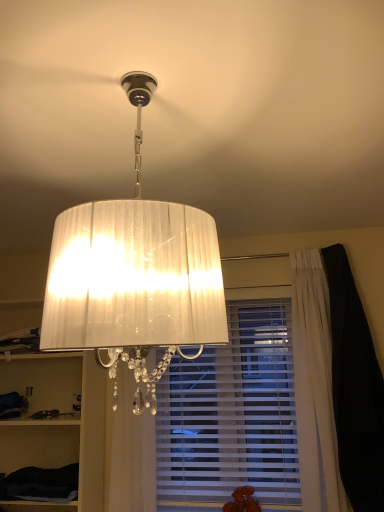
Measure the distance between point (x=176, y=398) and camera.

→ The distance of point (x=176, y=398) from camera is 7.75 feet.

In order to face white pleated curtain at lower center, should I rotate leftwards or rightwards?

To face it directly, rotate right by 4.107 degrees.

Identify the location of dark fabric cabinet at lower left, which is the first cabinet in bottom-to-top order. The image size is (384, 512). (37, 445).

In order to click on black velvet curtain at right in this screenshot , I will do `click(355, 388)`.

Between white fabric cabinet at left, the first cabinet when ordered from top to bottom, and white sheer curtain at center, which one has smaller size?

Smaller between the two is white sheer curtain at center.

Does point (47, 467) appear closer or farther from the camera than point (107, 435)?

Point (47, 467) appears to be farther away from the viewer than point (107, 435).

Looking at this image, from a real-world perspective, is white fabric cabinet at left, the first cabinet when ordered from top to bottom, above or below white sheer curtain at center?

white fabric cabinet at left, the first cabinet when ordered from top to bottom, is above white sheer curtain at center.

Consider the image. Considering the sizes of objects white pleated curtain at lower center and white sheer curtain at center in the image provided, who is shorter, white pleated curtain at lower center or white sheer curtain at center?

With less height is white sheer curtain at center.

Is white pleated curtain at lower center closer to the viewer compared to white sheer curtain at center?

No, the depth of white pleated curtain at lower center is greater than that of white sheer curtain at center.

Can you tell me how much white pleated curtain at lower center and white sheer curtain at center differ in facing direction?

The angular difference between white pleated curtain at lower center and white sheer curtain at center is 0.106 degrees.

Measure the distance between white pleated curtain at lower center and white sheer curtain at center.

A distance of 18.44 inches exists between white pleated curtain at lower center and white sheer curtain at center.

Considering the relative sizes of white fabric cabinet at left, which ranks as the 2th cabinet in bottom-to-top order, and white pleated fabric lampshade at upper center in the image provided, is white fabric cabinet at left, which ranks as the 2th cabinet in bottom-to-top order, shorter than white pleated fabric lampshade at upper center?

No.

Is white fabric cabinet at left, which ranks as the 2th cabinet in bottom-to-top order, wider than white pleated fabric lampshade at upper center?

In fact, white fabric cabinet at left, which ranks as the 2th cabinet in bottom-to-top order, might be narrower than white pleated fabric lampshade at upper center.

From the image's perspective, is white fabric cabinet at left, which ranks as the 2th cabinet in bottom-to-top order, on white pleated fabric lampshade at upper center?

Actually, white fabric cabinet at left, which ranks as the 2th cabinet in bottom-to-top order, appears below white pleated fabric lampshade at upper center in the image.

Considering the relative positions of white fabric cabinet at left, the first cabinet when ordered from top to bottom, and white pleated fabric lampshade at upper center in the image provided, is white fabric cabinet at left, the first cabinet when ordered from top to bottom, to the left of white pleated fabric lampshade at upper center from the viewer's perspective?

Yes.

From a real-world perspective, who is located higher, dark fabric cabinet at lower left, which is the first cabinet in bottom-to-top order, or black velvet curtain at right?

In real-world perspective, black velvet curtain at right is above.

Who is shorter, dark fabric cabinet at lower left, which is the first cabinet in bottom-to-top order, or black velvet curtain at right?

With less height is dark fabric cabinet at lower left, which is the first cabinet in bottom-to-top order.

Identify the location of cabinet that is the 2nd one below the black velvet curtain at right (from a real-world perspective). (37, 445).

Which object is more forward, dark fabric cabinet at lower left, which appears as the second cabinet when viewed from the top, or black velvet curtain at right?

black velvet curtain at right is more forward.

Considering the relative sizes of black velvet curtain at right and dark fabric cabinet at lower left, which is the first cabinet in bottom-to-top order, in the image provided, is black velvet curtain at right thinner than dark fabric cabinet at lower left, which is the first cabinet in bottom-to-top order,?

Indeed, black velvet curtain at right has a lesser width compared to dark fabric cabinet at lower left, which is the first cabinet in bottom-to-top order.

You are a GUI agent. You are given a task and a screenshot of the screen. Output one action in this format:
    pyautogui.click(x=<x>, y=<y>)
    Task: Click on the dark to the right of dark fabric cabinet at lower left, which is the first cabinet in bottom-to-top order
    Image resolution: width=384 pixels, height=512 pixels.
    Given the screenshot: What is the action you would take?
    pyautogui.click(x=355, y=388)

Which is nearer, (364,375) or (18,443)?

Point (364,375)

In the image, is black velvet curtain at right positioned in front of or behind dark fabric cabinet at lower left, which is the first cabinet in bottom-to-top order?

Clearly, black velvet curtain at right is in front of dark fabric cabinet at lower left, which is the first cabinet in bottom-to-top order.

Does white sheer curtain at center have a larger size compared to white pleated curtain at lower center?

Yes, white sheer curtain at center is bigger than white pleated curtain at lower center.

Considering the positions of objects white sheer curtain at center and white pleated curtain at lower center in the image provided, who is more to the left, white sheer curtain at center or white pleated curtain at lower center?

Positioned to the left is white sheer curtain at center.

In the image, is white sheer curtain at center positioned in front of or behind white pleated curtain at lower center?

Clearly, white sheer curtain at center is in front of white pleated curtain at lower center.

How much distance is there between white sheer curtain at center and white pleated curtain at lower center?

white sheer curtain at center and white pleated curtain at lower center are 46.83 centimeters apart from each other.

Is black velvet curtain at right shorter than white pleated fabric lampshade at upper center?

In fact, black velvet curtain at right may be taller than white pleated fabric lampshade at upper center.

Measure the distance from black velvet curtain at right to white pleated fabric lampshade at upper center.

4.79 feet.

Is white pleated fabric lampshade at upper center located within black velvet curtain at right?

No, white pleated fabric lampshade at upper center is not surrounded by black velvet curtain at right.

Locate an element on the screen. cabinet that is the 1st one when counting backward from the white sheer curtain at center is located at coordinates (58, 420).

Locate an element on the screen. This screenshot has width=384, height=512. curtain below the white pleated curtain at lower center (from a real-world perspective) is located at coordinates (128, 450).

From the image, which object appears to be nearer to white pleated curtain at lower center, white sheer curtain at center or black velvet curtain at right?

Based on the image, white sheer curtain at center appears to be nearer to white pleated curtain at lower center.

Estimate the real-world distances between objects in this image. Which object is closer to white fabric cabinet at left, which ranks as the 2th cabinet in bottom-to-top order, black velvet curtain at right or white sheer curtain at center?

white sheer curtain at center is positioned closer to the anchor white fabric cabinet at left, which ranks as the 2th cabinet in bottom-to-top order.

Which object lies further to the anchor point dark fabric cabinet at lower left, which appears as the second cabinet when viewed from the top, white pleated fabric lampshade at upper center or black velvet curtain at right?

white pleated fabric lampshade at upper center lies further to dark fabric cabinet at lower left, which appears as the second cabinet when viewed from the top, than the other object.

Looking at the image, which one is located further to white pleated curtain at lower center, white pleated fabric lampshade at upper center or black velvet curtain at right?

The object further to white pleated curtain at lower center is white pleated fabric lampshade at upper center.

When comparing their distances from white pleated fabric lampshade at upper center, does white sheer curtain at center or dark fabric cabinet at lower left, which is the first cabinet in bottom-to-top order, seem closer?

Based on the image, white sheer curtain at center appears to be nearer to white pleated fabric lampshade at upper center.

Looking at the image, which one is located closer to white sheer curtain at center, white pleated fabric lampshade at upper center or dark fabric cabinet at lower left, which appears as the second cabinet when viewed from the top?

The object closer to white sheer curtain at center is dark fabric cabinet at lower left, which appears as the second cabinet when viewed from the top.

When comparing their distances from white pleated fabric lampshade at upper center, does white fabric cabinet at left, the first cabinet when ordered from top to bottom, or white pleated curtain at lower center seem further?

white fabric cabinet at left, the first cabinet when ordered from top to bottom, lies further to white pleated fabric lampshade at upper center than the other object.

Estimate the real-world distances between objects in this image. Which object is further from white sheer curtain at center, black velvet curtain at right or white pleated fabric lampshade at upper center?

The object further to white sheer curtain at center is white pleated fabric lampshade at upper center.

This screenshot has height=512, width=384. Find the location of `dark positioned between white pleated fabric lampshade at upper center and dark fabric cabinet at lower left, which appears as the second cabinet when viewed from the top, from near to far`. dark positioned between white pleated fabric lampshade at upper center and dark fabric cabinet at lower left, which appears as the second cabinet when viewed from the top, from near to far is located at coordinates (355, 388).

I want to click on curtain between white fabric cabinet at left, the first cabinet when ordered from top to bottom, and black velvet curtain at right, so click(x=128, y=450).

Locate an element on the screen. Image resolution: width=384 pixels, height=512 pixels. curtain between white fabric cabinet at left, the first cabinet when ordered from top to bottom, and white pleated curtain at lower center is located at coordinates (128, 450).

I want to click on curtain situated between dark fabric cabinet at lower left, which is the first cabinet in bottom-to-top order, and white pleated curtain at lower center from left to right, so click(x=128, y=450).